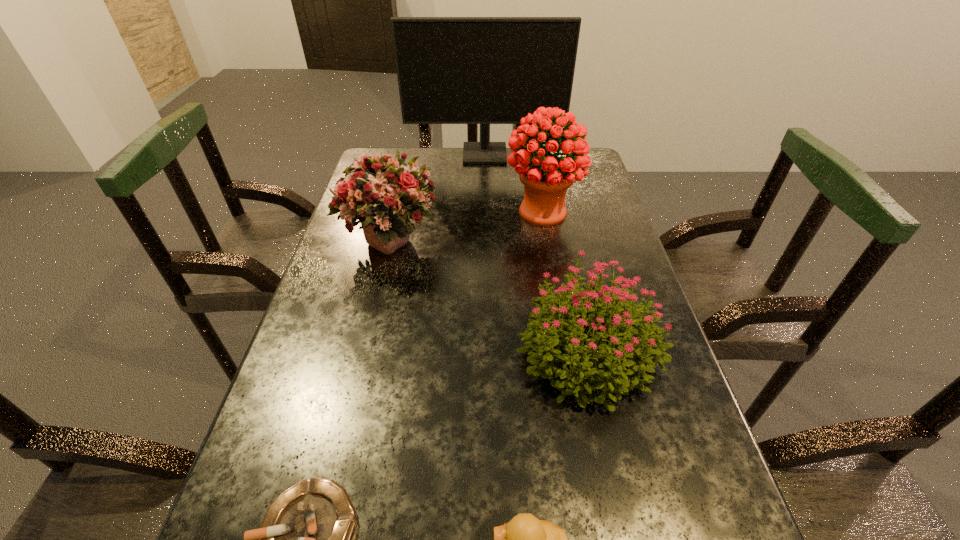
Locate an element on the screen. This screenshot has height=540, width=960. the farthest object is located at coordinates (451, 70).

What are the coordinates of `computer monitor` in the screenshot? It's located at (451, 70).

Identify the location of the second tallest object. Image resolution: width=960 pixels, height=540 pixels. (546, 179).

Image resolution: width=960 pixels, height=540 pixels. In order to click on the leftmost bouquet in this screenshot , I will do `click(383, 194)`.

Locate an element on the screen. The image size is (960, 540). the third nearest object is located at coordinates (599, 366).

Locate an element on the screen. This screenshot has width=960, height=540. vacant area located on the front-facing side of the tallest object is located at coordinates (486, 197).

At what (x,y) coordinates should I click in order to perform the action: click on vacant space located 0.250m on the left of the tallest bouquet. Please return your answer as a coordinate pair (x, y). Looking at the image, I should click on (417, 212).

You are a GUI agent. You are given a task and a screenshot of the screen. Output one action in this format:
    pyautogui.click(x=<x>, y=<y>)
    Task: Click on the vacant region located 0.100m on the back of the leftmost bouquet
    This screenshot has height=540, width=960.
    Given the screenshot: What is the action you would take?
    pyautogui.click(x=401, y=193)

Image resolution: width=960 pixels, height=540 pixels. I want to click on vacant area located on the back of the third nearest object, so click(555, 204).

Where is `object situated at the far edge`? This screenshot has height=540, width=960. object situated at the far edge is located at coordinates (451, 70).